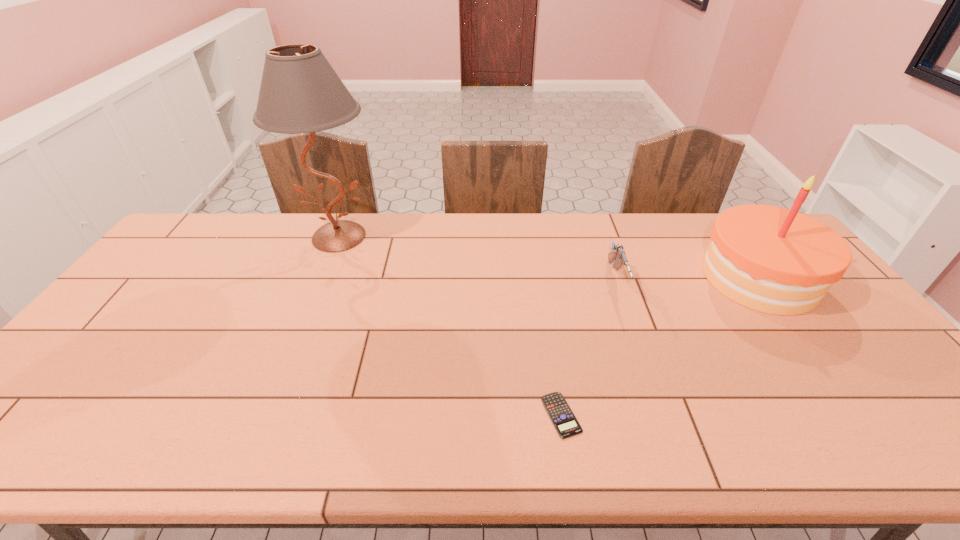
Image resolution: width=960 pixels, height=540 pixels. I want to click on free space located 0.190m at the barrel of the second object from right to left, so point(643,357).

You are a GUI agent. You are given a task and a screenshot of the screen. Output one action in this format:
    pyautogui.click(x=<x>, y=<y>)
    Task: Click on the vacant space situated on the left of the calculator
    This screenshot has height=540, width=960.
    Given the screenshot: What is the action you would take?
    pyautogui.click(x=376, y=415)

This screenshot has width=960, height=540. I want to click on table lamp at the far edge, so click(300, 92).

Locate an element on the screen. The image size is (960, 540). birthday cake that is positioned at the far edge is located at coordinates (770, 259).

Where is `object present at the near edge`? The width and height of the screenshot is (960, 540). object present at the near edge is located at coordinates (557, 408).

The height and width of the screenshot is (540, 960). What are the coordinates of `object located at the right edge` in the screenshot? It's located at pos(770,259).

The image size is (960, 540). In order to click on object present at the far right corner in this screenshot , I will do `click(770, 259)`.

Locate an element on the screen. free space at the far edge is located at coordinates (703, 242).

In the image, there is a desktop. Where is `vacant space at the near edge`? Image resolution: width=960 pixels, height=540 pixels. vacant space at the near edge is located at coordinates (203, 458).

Locate an element on the screen. The image size is (960, 540). vacant space at the left edge is located at coordinates 53,391.